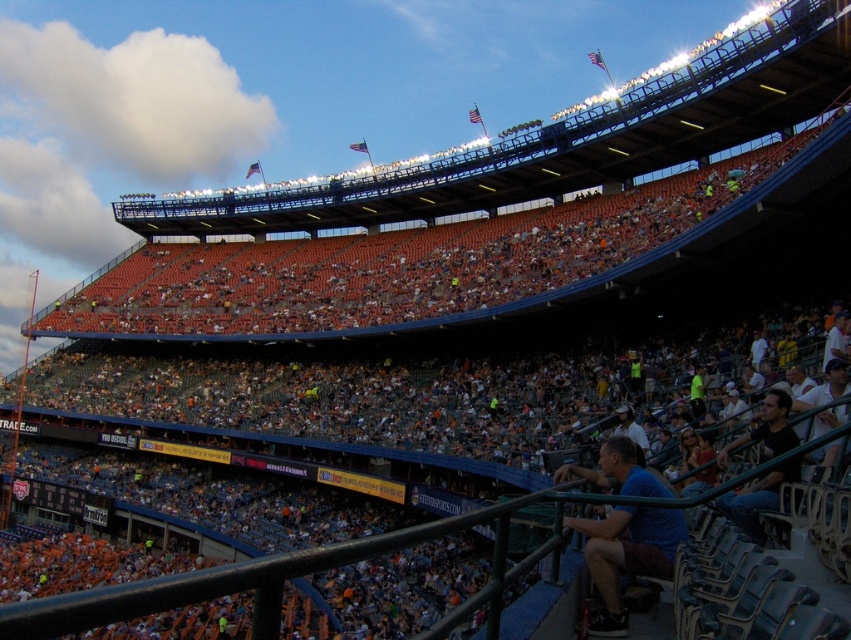
Question: Does blue cotton shirt at lower right have a greater width compared to white fabric shirt at lower right?

Choices:
 (A) no
 (B) yes

Answer: (A)

Question: Which object appears closest to the camera in this image?

Choices:
 (A) blue cotton shirt at lower right
 (B) white fabric shirt at lower right

Answer: (A)

Question: Which object appears farthest from the camera in this image?

Choices:
 (A) white fabric shirt at lower right
 (B) blue cotton shirt at lower right

Answer: (A)

Question: Does blue cotton shirt at lower right have a larger size compared to white fabric shirt at lower right?

Choices:
 (A) yes
 (B) no

Answer: (A)

Question: Can you confirm if blue cotton shirt at lower right is positioned below white fabric shirt at lower right?

Choices:
 (A) no
 (B) yes

Answer: (B)